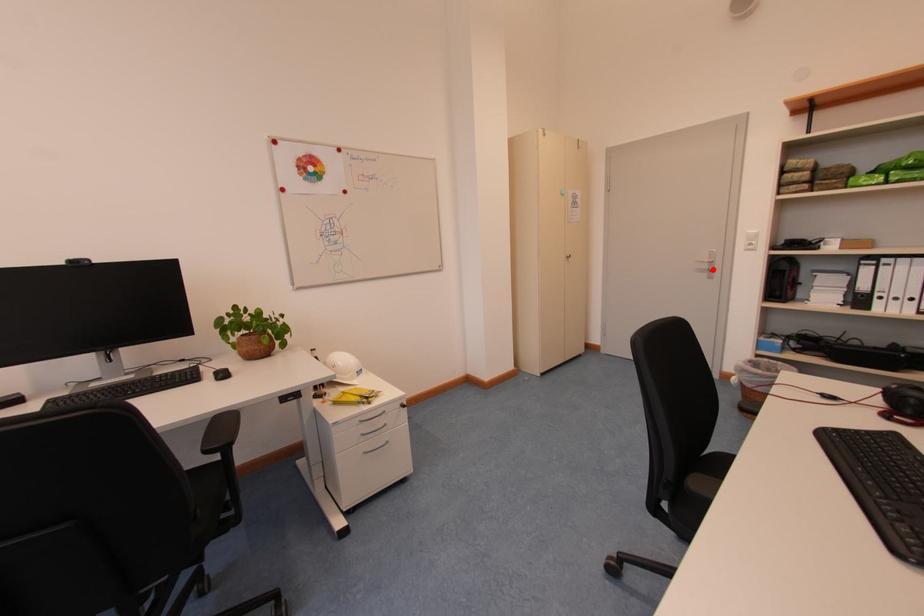
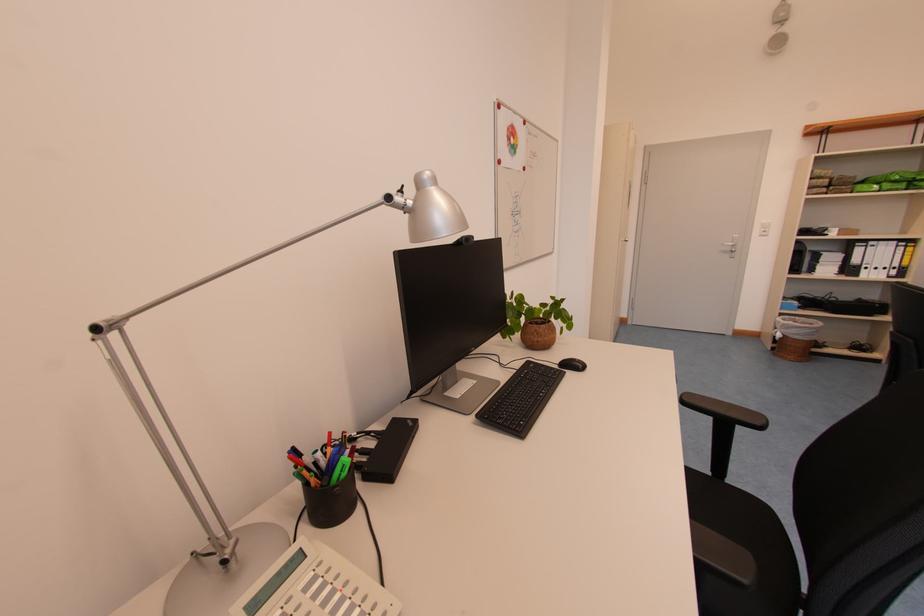
Find the pixel in the second image that matches the highlighted location in the first image.

(736, 252)